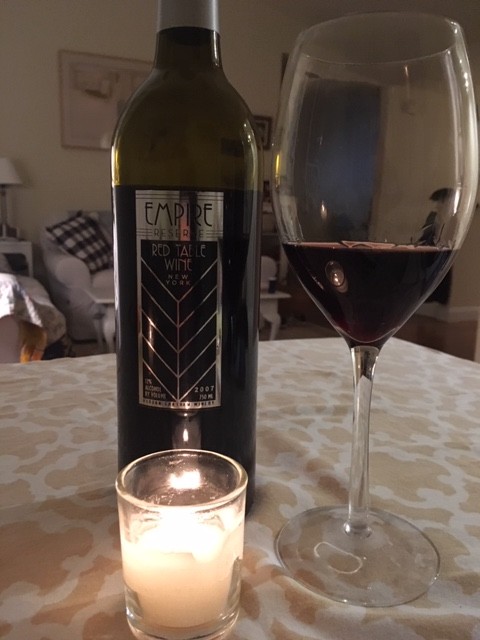
Locate an element on the screen. table is located at coordinates (54, 505).